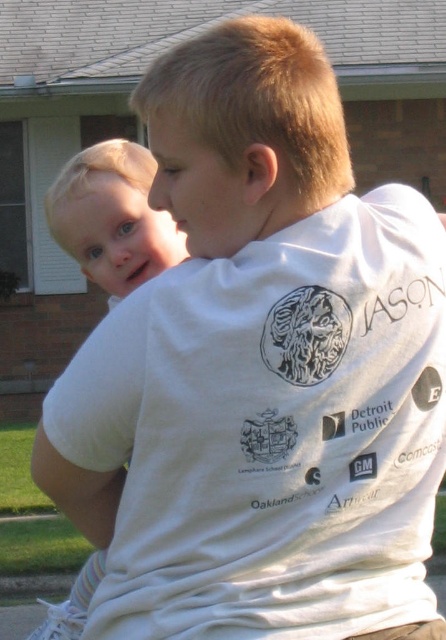
Please check the coordinates provided. Is the point at (112, 218) located on the light blonde hair of the toddler at the left side?

Yes, the point at (112, 218) is located on the light blonde hair of the toddler at the left side as described.

You are a photographer trying to capture a closeup shot of both the light blonde hair at left and the blonde hair baby at upper left. Given that your camera has a minimum focusing distance of 3 feet, will you be able to take the photo without moving closer?

The distance between the light blonde hair at left and the blonde hair baby at upper left is 3.54 feet, which is greater than the camera minimum focusing distance of 3 feet. Therefore, the photographer can take the photo without moving closer.

You are standing in the scene and want to move from point A to point B. Point A is at coordinates point(81, 161) and point B is at point(106, 259). Which point is closer to you?

Point(81, 161) is closer to you because it is further to the viewer than point(106, 259).